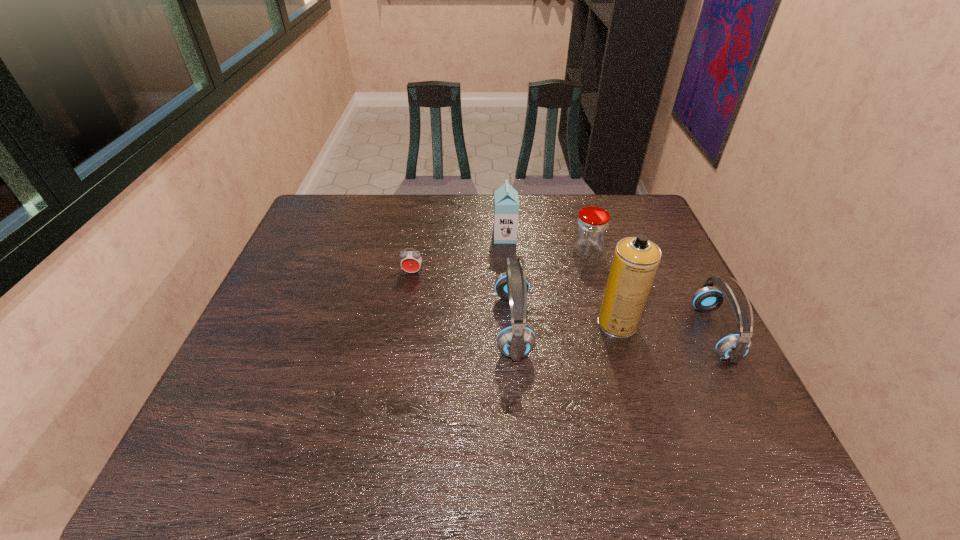
This screenshot has width=960, height=540. What are the coordinates of `free spot located 0.200m on the face of the shortest object` in the screenshot? It's located at pyautogui.click(x=403, y=329).

The width and height of the screenshot is (960, 540). I want to click on vacant space located on the left of the milk carton, so click(x=456, y=237).

Image resolution: width=960 pixels, height=540 pixels. Find the location of `vacant region located on the left of the aerosol can`. vacant region located on the left of the aerosol can is located at coordinates (473, 323).

This screenshot has height=540, width=960. Identify the location of object located in the far edge section of the desktop. (506, 202).

At what (x,y) coordinates should I click in order to perform the action: click on object that is at the right edge. Please return your answer as a coordinate pair (x, y). The width and height of the screenshot is (960, 540). Looking at the image, I should click on (732, 347).

Identify the location of vacant space at the far edge of the desktop. The height and width of the screenshot is (540, 960). (472, 221).

You are a GUI agent. You are given a task and a screenshot of the screen. Output one action in this format:
    pyautogui.click(x=<x>, y=<y>)
    Task: Click on the vacant area at the near edge
    This screenshot has width=960, height=540.
    Given the screenshot: What is the action you would take?
    pyautogui.click(x=439, y=420)

You are a GUI agent. You are given a task and a screenshot of the screen. Output one action in this format:
    pyautogui.click(x=<x>, y=<y>)
    Task: Click on the blank space at the left edge
    The height and width of the screenshot is (540, 960).
    Given the screenshot: What is the action you would take?
    pyautogui.click(x=311, y=239)

Where is `vacant space at the right edge`? The image size is (960, 540). vacant space at the right edge is located at coordinates (660, 237).

In the image, there is a desktop. At what (x,y) coordinates should I click in order to perform the action: click on free space at the far left corner. Please return your answer as a coordinate pair (x, y). This screenshot has height=540, width=960. Looking at the image, I should click on (322, 211).